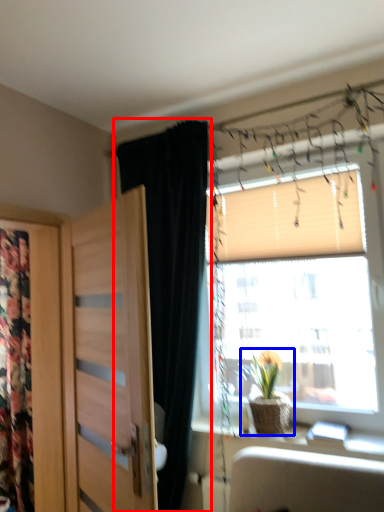
Question: Which of the following is the closest to the observer, curtain (highlighted by a red box) or houseplant (highlighted by a blue box)?

Choices:
 (A) curtain
 (B) houseplant

Answer: (A)